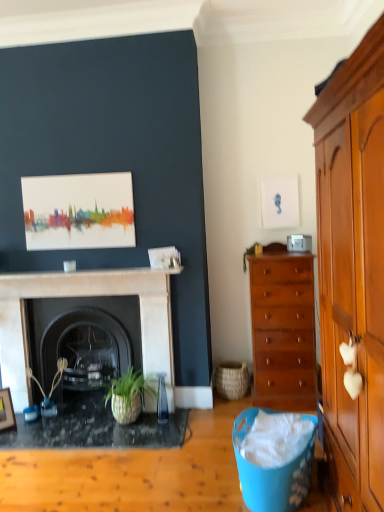
What do you see at coordinates (251, 253) in the screenshot? I see `green leafy plant at center-right, the 2th plant in the bottom-to-top sequence` at bounding box center [251, 253].

In order to face blue plastic trash can at lower center, should I rotate leftwards or rightwards?

To align with it, rotate right about 11.598°.

Identify the location of black marble fireplace at center, which is the 1th fireplace in front-to-back order. (86, 296).

Find the location of a particular element. Image resolution: width=384 pixels, height=512 pixels. mahogany wooden chest of drawers at right is located at coordinates (283, 332).

This screenshot has width=384, height=512. I want to click on green woven plant at left, which appears as the 2th plant when viewed from the top, so click(x=53, y=378).

Measure the distance between point (10, 424) and camera.

A distance of 3.15 meters exists between point (10, 424) and camera.

What is the approximate height of matte white coffee cup at upper center?

matte white coffee cup at upper center is 3.55 inches tall.

Identify the location of green leafy plant at center-right, the first plant positioned from the top. (251, 253).

Are matte white coffee cup at upper center and black marble fireplace at center, arranged as the 2th fireplace when viewed from the front, beside each other?

matte white coffee cup at upper center is not next to black marble fireplace at center, arranged as the 2th fireplace when viewed from the front, and they're not touching.

Is matte white coffee cup at upper center shorter than black marble fireplace at center, arranged as the 2th fireplace when viewed from the front?

Correct, matte white coffee cup at upper center is not as tall as black marble fireplace at center, arranged as the 2th fireplace when viewed from the front.

Which of these two, matte white coffee cup at upper center or black marble fireplace at center, the 1th fireplace when ordered from back to front, is bigger?

black marble fireplace at center, the 1th fireplace when ordered from back to front.

Is point (69, 271) behind point (55, 328)?

No.

Are black marble fireplace at center, which is the 1th fireplace in front-to-back order, and wooden picture frame at lower left located far from each other?

No, black marble fireplace at center, which is the 1th fireplace in front-to-back order, is not far from wooden picture frame at lower left.

Does black marble fireplace at center, the second fireplace positioned from the back, turn towards wooden picture frame at lower left?

Yes, black marble fireplace at center, the second fireplace positioned from the back, is facing wooden picture frame at lower left.

Which fireplace is the 1st one when counting from the back of the wooden picture frame at lower left? Please provide its 2D coordinates.

[(86, 296)]

Can you tell me how much black marble fireplace at center, which is the 1th fireplace in front-to-back order, and wooden picture frame at lower left differ in facing direction?

There is a 43.4-degree angle between the facing directions of black marble fireplace at center, which is the 1th fireplace in front-to-back order, and wooden picture frame at lower left.

How different are the orientations of black marble fireplace at center, the 1th fireplace when ordered from back to front, and wooden wardrobe at right in degrees?

black marble fireplace at center, the 1th fireplace when ordered from back to front, and wooden wardrobe at right are facing 90.8 degrees away from each other.

Which is in front, black marble fireplace at center, arranged as the 2th fireplace when viewed from the front, or wooden wardrobe at right?

wooden wardrobe at right is closer to the camera.

Is black marble fireplace at center, arranged as the 2th fireplace when viewed from the front, looking in the opposite direction of wooden wardrobe at right?

black marble fireplace at center, arranged as the 2th fireplace when viewed from the front, does not have its back to wooden wardrobe at right.

Is black marble fireplace at center, arranged as the 2th fireplace when viewed from the front, positioned beyond the bounds of wooden wardrobe at right?

Yes, black marble fireplace at center, arranged as the 2th fireplace when viewed from the front, is not within wooden wardrobe at right.

Which fireplace is the 1st one when counting from the back of the mahogany wooden chest of drawers at right? Please provide its 2D coordinates.

[(86, 296)]

Which is in front, mahogany wooden chest of drawers at right or black marble fireplace at center, the second fireplace positioned from the back?

Positioned in front is mahogany wooden chest of drawers at right.

Looking at their sizes, would you say mahogany wooden chest of drawers at right is wider or thinner than black marble fireplace at center, the second fireplace positioned from the back?

Clearly, mahogany wooden chest of drawers at right has more width compared to black marble fireplace at center, the second fireplace positioned from the back.

From a real-world perspective, is mahogany wooden chest of drawers at right under black marble fireplace at center, the second fireplace positioned from the back?

No.

Is mahogany wooden chest of drawers at right wider than green leafy plant at center-right, the 2th plant in the bottom-to-top sequence?

Yes, mahogany wooden chest of drawers at right is wider than green leafy plant at center-right, the 2th plant in the bottom-to-top sequence.

At what (x,y) coordinates should I click in order to perform the action: click on chest of drawers to the right of green leafy plant at center-right, the second plant viewed from the left. Please return your answer as a coordinate pair (x, y). The width and height of the screenshot is (384, 512). Looking at the image, I should click on (283, 332).

Considering their positions, is mahogany wooden chest of drawers at right located in front of or behind green leafy plant at center-right, the 2th plant in the bottom-to-top sequence?

Visually, mahogany wooden chest of drawers at right is located in front of green leafy plant at center-right, the 2th plant in the bottom-to-top sequence.

Looking at this image, considering the relative positions of mahogany wooden chest of drawers at right and green leafy plant at center-right, the second plant viewed from the left, in the image provided, is mahogany wooden chest of drawers at right to the left or to the right of green leafy plant at center-right, the second plant viewed from the left,?

Clearly, mahogany wooden chest of drawers at right is on the right of green leafy plant at center-right, the second plant viewed from the left, in the image.

Looking at the image, does green leafy plant at center-right, the second plant viewed from the left, seem bigger or smaller compared to granite black desk at center?

Considering their sizes, green leafy plant at center-right, the second plant viewed from the left, takes up less space than granite black desk at center.

Is green leafy plant at center-right, the first plant from the right, located outside granite black desk at center?

Yes, green leafy plant at center-right, the first plant from the right, is located beyond the bounds of granite black desk at center.

Find the location of `desk that is under the green leafy plant at center-right, the second plant viewed from the left (from a real-world perspective)`. desk that is under the green leafy plant at center-right, the second plant viewed from the left (from a real-world perspective) is located at coordinates (95, 430).

From a real-world perspective, does green leafy plant at center-right, the first plant from the right, stand above granite black desk at center?

Yes, from a real-world perspective, green leafy plant at center-right, the first plant from the right, is over granite black desk at center

From the image's perspective, which is below, wooden wardrobe at right or green leafy plant at center-right, the 2th plant in the bottom-to-top sequence?

wooden wardrobe at right, from the image's perspective.

In the scene shown: Which is correct: wooden wardrobe at right is inside green leafy plant at center-right, the 2th plant in the bottom-to-top sequence, or outside of it?

wooden wardrobe at right lies outside green leafy plant at center-right, the 2th plant in the bottom-to-top sequence.

Which object is more forward, wooden wardrobe at right or green leafy plant at center-right, the first plant positioned from the top?

Positioned in front is wooden wardrobe at right.

Where is `plant above the wooden wardrobe at right (from a real-world perspective)`? plant above the wooden wardrobe at right (from a real-world perspective) is located at coordinates (251, 253).

Locate an element on the screen. The height and width of the screenshot is (512, 384). fireplace behind the matte white coffee cup at upper center is located at coordinates (85, 339).

Identify the location of picture frame below the black marble fireplace at center, which is the 1th fireplace in front-to-back order (from the image's perspective). This screenshot has width=384, height=512. (6, 411).

When comparing their distances from black marble fireplace at center, the 1th fireplace when ordered from back to front, does green woven plant at left, which is the 2th plant from right to left, or blue plastic trash can at lower center seem closer?

Based on the image, green woven plant at left, which is the 2th plant from right to left, appears to be nearer to black marble fireplace at center, the 1th fireplace when ordered from back to front.

Which object lies further to the anchor point green leafy plant at center-right, the 2th plant in the bottom-to-top sequence, wooden picture frame at lower left or woven natural basket at lower center?

wooden picture frame at lower left.

From the picture: Looking at the image, which one is located closer to green leafy plant at center-right, the first plant positioned from the top, mahogany wooden chest of drawers at right or blue plastic trash can at lower center?

mahogany wooden chest of drawers at right.

Estimate the real-world distances between objects in this image. Which object is further from mahogany wooden chest of drawers at right, black marble fireplace at center, arranged as the 2th fireplace when viewed from the front, or wooden wardrobe at right?

Based on the image, black marble fireplace at center, arranged as the 2th fireplace when viewed from the front, appears to be further to mahogany wooden chest of drawers at right.

Considering their positions, is green woven plant at left, positioned as the 1th plant in left-to-right order, positioned closer to woven natural basket at lower center than black marble fireplace at center, the second fireplace positioned from the back?

Among the two, black marble fireplace at center, the second fireplace positioned from the back, is located nearer to woven natural basket at lower center.

Considering their positions, is matte white coffee cup at upper center positioned further to mahogany wooden chest of drawers at right than green leafy plant at center-right, the first plant positioned from the top?

Among the two, matte white coffee cup at upper center is located further to mahogany wooden chest of drawers at right.

Based on the photo, from the image, which object appears to be farther from woven natural basket at lower center, wooden wardrobe at right or green leafy plant at center-right, the 2th plant in the bottom-to-top sequence?

wooden wardrobe at right.

From the image, which object appears to be nearer to granite black desk at center, green leafy plant at center-right, the first plant positioned from the top, or matte white coffee cup at upper center?

Based on the image, matte white coffee cup at upper center appears to be nearer to granite black desk at center.

Locate an element on the screen. desk between wooden picture frame at lower left and blue plastic trash can at lower center is located at coordinates (95, 430).

I want to click on plant between green woven plant at left, which is the 2th plant from right to left, and mahogany wooden chest of drawers at right from left to right, so click(x=251, y=253).

Locate an element on the screen. The height and width of the screenshot is (512, 384). trash bin/can between wooden wardrobe at right and granite black desk at center along the z-axis is located at coordinates (270, 473).

Find the location of a particular element. plant that lies between matte white coffee cup at upper center and wooden picture frame at lower left from top to bottom is located at coordinates (53, 378).